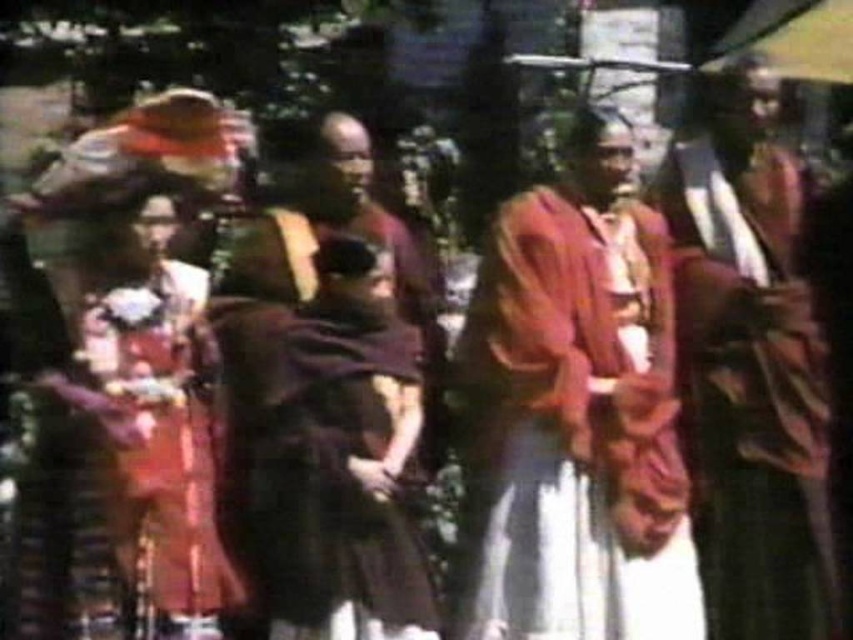
Can you confirm if dark brown robe at center is positioned below silky maroon robe at center?

Indeed, dark brown robe at center is positioned under silky maroon robe at center.

Between point (254, 426) and point (810, 412), which one is positioned in front?

Point (254, 426)

At what (x,y) coordinates should I click in order to perform the action: click on dark brown robe at center. Please return your answer as a coordinate pair (x, y). Image resolution: width=853 pixels, height=640 pixels. Looking at the image, I should click on (323, 413).

Can you confirm if silky maroon robe at center is smaller than matte orange dress at left?

Incorrect, silky maroon robe at center is not smaller in size than matte orange dress at left.

Can you confirm if silky maroon robe at center is wider than matte orange dress at left?

Correct, the width of silky maroon robe at center exceeds that of matte orange dress at left.

Where is `silky maroon robe at center`? silky maroon robe at center is located at coordinates (747, 364).

Locate an element on the screen. The image size is (853, 640). silky maroon robe at center is located at coordinates (747, 364).

Does matte orange robe at center appear on the left side of silky maroon robe at center?

Correct, you'll find matte orange robe at center to the left of silky maroon robe at center.

Does matte orange robe at center have a lesser height compared to silky maroon robe at center?

Indeed, matte orange robe at center has a lesser height compared to silky maroon robe at center.

Where is `matte orange robe at center`? Image resolution: width=853 pixels, height=640 pixels. matte orange robe at center is located at coordinates (573, 416).